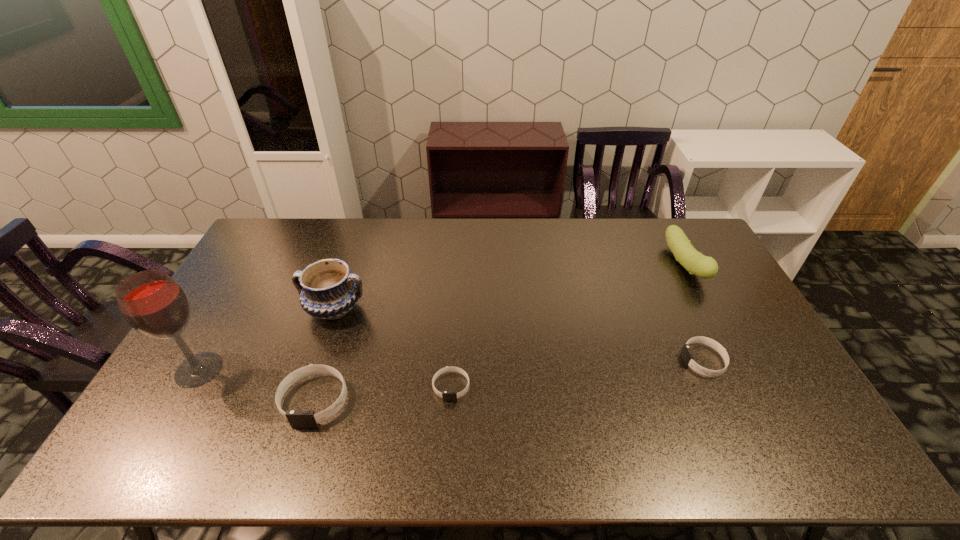
Please point a space for a new wristband to maintain equal intervals. Please provide its 2D coordinates. Your answer should be formatted as a tuple, i.e. [(x, y)], where the tuple contains the x and y coordinates of a point satisfying the conditions above.

[(581, 373)]